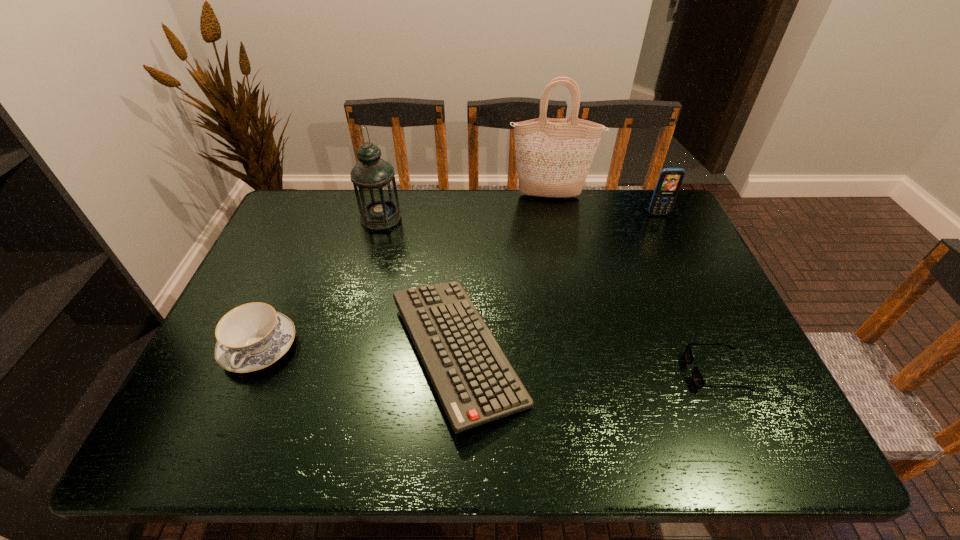
The height and width of the screenshot is (540, 960). In order to click on free location at the far right corner of the desktop in this screenshot , I will do `click(644, 211)`.

Where is `empty space that is in between the shortest object and the computer keyboard`? The height and width of the screenshot is (540, 960). empty space that is in between the shortest object and the computer keyboard is located at coordinates (587, 362).

Where is `free area in between the leftmost object and the fifth tallest object`? free area in between the leftmost object and the fifth tallest object is located at coordinates (358, 350).

You are a GUI agent. You are given a task and a screenshot of the screen. Output one action in this format:
    pyautogui.click(x=<x>, y=<y>)
    Task: Click on the vacant area between the second tallest object and the chinaware
    
    Given the screenshot: What is the action you would take?
    pyautogui.click(x=320, y=283)

Where is `free space between the second tallest object and the computer keyboard`? The height and width of the screenshot is (540, 960). free space between the second tallest object and the computer keyboard is located at coordinates (420, 285).

You are a GUI agent. You are given a task and a screenshot of the screen. Output one action in this format:
    pyautogui.click(x=<x>, y=<y>)
    Task: Click on the free space that is in between the fifth tallest object and the cellular telephone
    This screenshot has width=960, height=540.
    Given the screenshot: What is the action you would take?
    pyautogui.click(x=558, y=284)

Where is `vacant area that lies between the fourth shortest object and the tallest object`? vacant area that lies between the fourth shortest object and the tallest object is located at coordinates (605, 205).

Find the location of a particular element. free space between the shopping bag and the leftmost object is located at coordinates (405, 272).

The height and width of the screenshot is (540, 960). I want to click on free space between the fifth object from right to left and the fifth tallest object, so click(x=420, y=285).

Where is `object that stands as the closest to the chinaware`? object that stands as the closest to the chinaware is located at coordinates (476, 384).